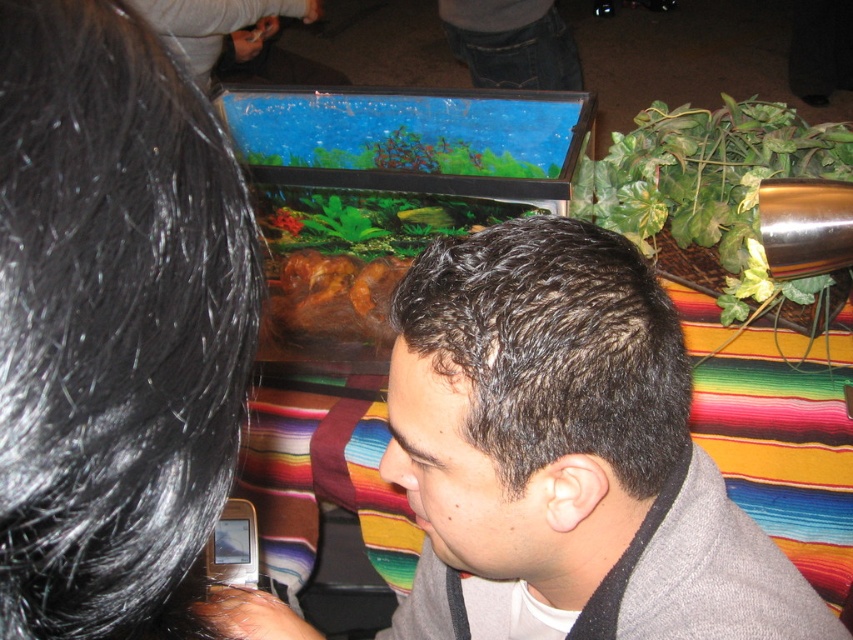
You are a photographer trying to capture a closeup of the metallic silver phone at lower left. The dark gray fabric at center is blocking your view. Can you move the fabric to the side to get a clear shot?

The dark gray fabric at center might be wider than metallic silver phone at lower left, so moving the fabric could help, but there is uncertainty about its width. You might need to adjust the fabric carefully to ensure the phone is visible without obstructing other elements.

From the picture: You are a photographer trying to capture a closeup of the metallic silver phone at lower left without the dark gray fabric at center blocking the view. Is the phone visible from your current position?

The dark gray fabric at center is located above the metallic silver phone at lower left, so the phone is partially or fully blocked by the fabric and may not be visible from your current position.

You are a photographer trying to capture a closeup shot of the metallic silver phone at lower left. You notice the dark gray fabric at center is blocking your view. Can you move the phone to the left to get a better angle? Explain why or why not based on their positions.

The dark gray fabric at center is to the right of the metallic silver phone at lower left. Moving the phone further to the left would place it even farther away from the fabric, so it might not block the view anymore. However, since the phone is already at the lower left, moving it left could cause it to fall off the edge of the surface. Consider moving the fabric instead.